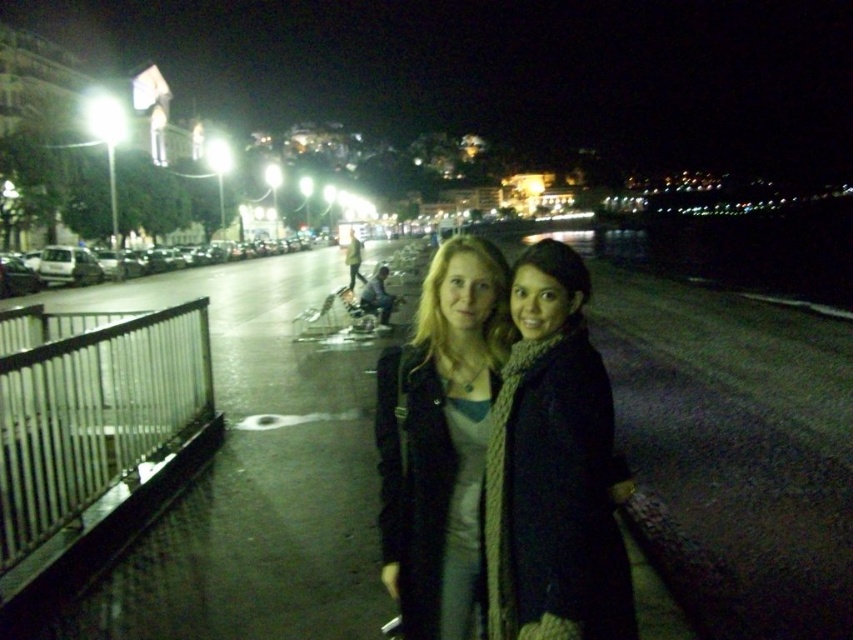
Which is above, knitted beige scarf at center or knitted scarf at center?

knitted beige scarf at center is higher up.

Can you confirm if knitted beige scarf at center is positioned above knitted scarf at center?

Indeed, knitted beige scarf at center is positioned over knitted scarf at center.

Does point (534, 456) lie behind point (413, 419)?

No, (534, 456) is in front of (413, 419).

This screenshot has height=640, width=853. Find the location of `knitted beige scarf at center`. knitted beige scarf at center is located at coordinates (x=552, y=468).